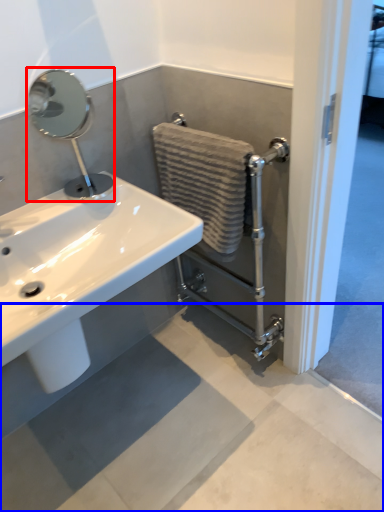
Question: Which object is closer to the camera taking this photo, plumbing fixture (highlighted by a red box) or concrete (highlighted by a blue box)?

Choices:
 (A) plumbing fixture
 (B) concrete

Answer: (B)